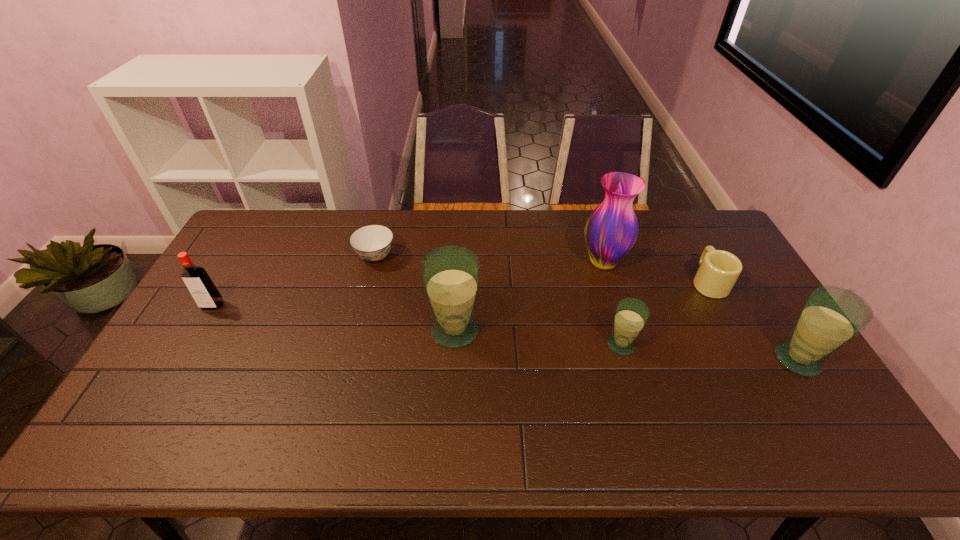
The height and width of the screenshot is (540, 960). In order to click on the leftmost object in this screenshot , I will do `click(204, 292)`.

Locate an element on the screen. vodka is located at coordinates (204, 292).

Where is `vacant space situated 0.130m on the back of the fifth object from right to left`? This screenshot has width=960, height=540. vacant space situated 0.130m on the back of the fifth object from right to left is located at coordinates coord(457,281).

Find the location of a particular element. The image size is (960, 540). free location located on the right of the second glass from left to right is located at coordinates (718, 345).

Locate an element on the screen. free space located on the back of the second tallest glass is located at coordinates (777, 327).

Where is `free space located 0.170m on the back of the vase`? free space located 0.170m on the back of the vase is located at coordinates (589, 218).

Identify the location of free region located 0.260m with the handle on the side of the second object from right to left. The height and width of the screenshot is (540, 960). (675, 219).

I want to click on free space located 0.050m with the handle on the side of the second object from right to left, so tap(694, 256).

This screenshot has height=540, width=960. I want to click on vacant space located 0.260m with the handle on the side of the second object from right to left, so click(x=675, y=219).

Find the location of a particular element. The height and width of the screenshot is (540, 960). vacant region located 0.140m on the left of the shortest object is located at coordinates (313, 256).